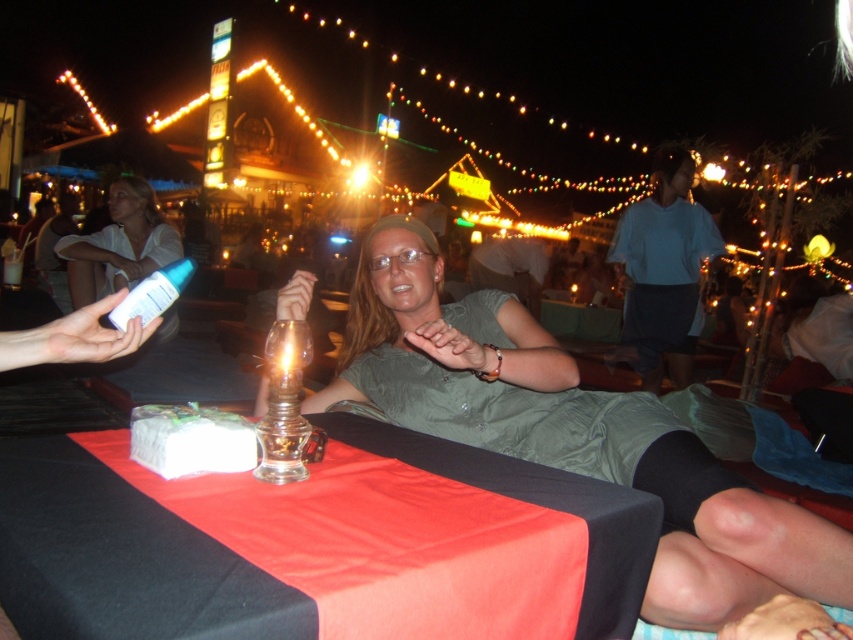
Question: Can you confirm if matte green dress at center is positioned below black satin tablecloth at center?

Choices:
 (A) no
 (B) yes

Answer: (A)

Question: Estimate the real-world distances between objects in this image. Which object is closer to the matte green dress at center?

Choices:
 (A) black satin tablecloth at center
 (B) white matte bottle at left

Answer: (A)

Question: Among these points, which one is nearest to the camera?

Choices:
 (A) (695, 308)
 (B) (653, 483)
 (C) (567, 477)

Answer: (C)

Question: Which of the following is the closest to the observer?

Choices:
 (A) (628, 328)
 (B) (142, 220)
 (C) (740, 557)
 (D) (650, 522)

Answer: (D)

Question: Observing the image, what is the correct spatial positioning of matte green dress at center in reference to light blue shirt at center?

Choices:
 (A) below
 (B) above

Answer: (A)

Question: Can you confirm if light blue shirt at center is smaller than white matte bottle at left?

Choices:
 (A) no
 (B) yes

Answer: (A)